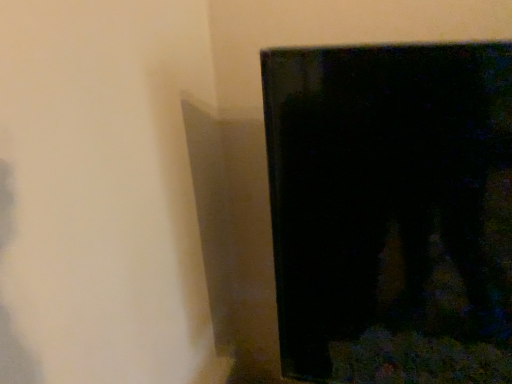
What do you see at coordinates (392, 211) in the screenshot? I see `matte black frame at right` at bounding box center [392, 211].

At what (x,y) coordinates should I click in order to perform the action: click on matte black frame at right. Please return your answer as a coordinate pair (x, y). Image resolution: width=512 pixels, height=384 pixels. Looking at the image, I should click on (392, 211).

Image resolution: width=512 pixels, height=384 pixels. I want to click on matte black frame at right, so click(392, 211).